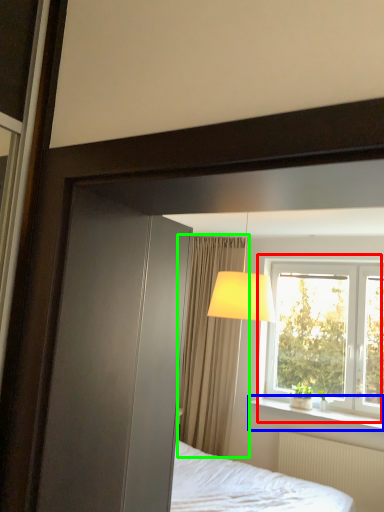
Question: Which object is the farthest from window (highlighted by a red box)? Choose among these: window sill (highlighted by a blue box) or curtain (highlighted by a green box).

Choices:
 (A) window sill
 (B) curtain

Answer: (B)